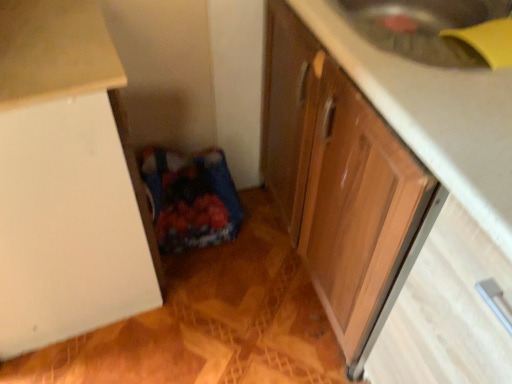
Question: From the image's perspective, is white matte cabinet at left, the second cabinetry in the right-to-left sequence, above or below wooden cabinet at lower right, acting as the 1th cabinetry starting from the right?

Choices:
 (A) below
 (B) above

Answer: (A)

Question: Looking at their shapes, would you say white matte cabinet at left, the second cabinetry in the right-to-left sequence, is wider or thinner than wooden cabinet at lower right, acting as the 2th cabinetry starting from the left?

Choices:
 (A) thin
 (B) wide

Answer: (A)

Question: Based on their relative distances, which object is nearer to the wooden drawer at lower right?

Choices:
 (A) wooden cabinet at lower right, acting as the 1th cabinetry starting from the right
 (B) white matte cabinet at left, the second cabinetry in the right-to-left sequence

Answer: (A)

Question: Estimate the real-world distances between objects in this image. Which object is closer to the wooden drawer at lower right?

Choices:
 (A) wooden cabinet at lower right, acting as the 2th cabinetry starting from the left
 (B) white matte cabinet at left, which is the 1th cabinetry from left to right

Answer: (A)